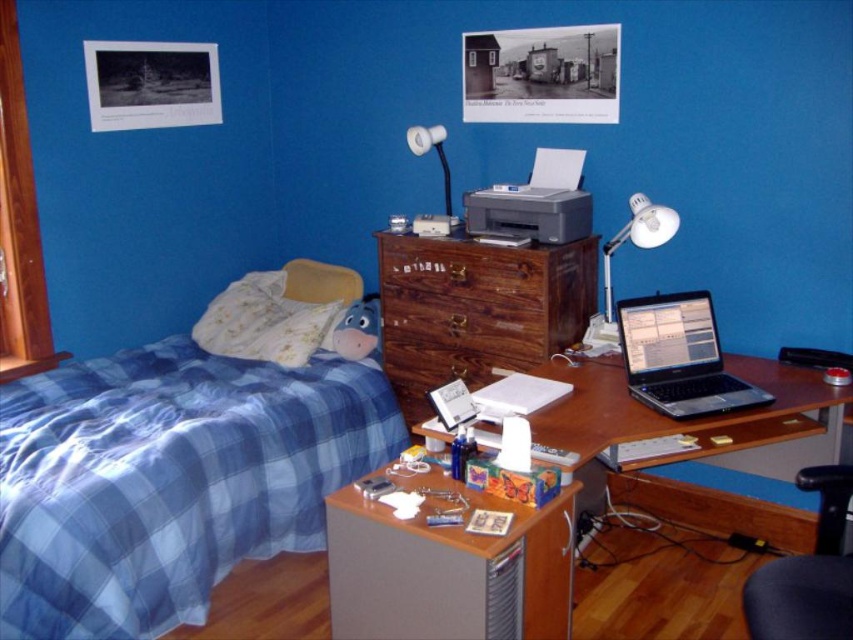
Consider the image. You are standing in the middle of the bedroom and want to place a new lamp on the wooden chest of drawers at center. Which direction should you move to reach it?

Since the wooden chest of drawers at center is located at point coordinates of [476,308], you are already standing in the middle of the bedroom, so you don not need to move any direction to reach it. You can place the new lamp directly on the wooden chest of drawers at center.

You are organizing your bedroom and need to move a 40 cm wide box from the wooden chest of drawers at center to the white plastic desk lamp at upper right. Can the box fit through the space between them without bending?

The wooden chest of drawers at center is 41.00 centimeters from the white plastic desk lamp at upper right, so the 40 cm wide box can fit through the space between them without bending.

You are organizing your bedroom and need to place a new bookshelf. The bookshelf is taller than the wooden chest of drawers at center. Will the bookshelf also be taller than the silver metallic printer at center?

The wooden chest of drawers at center is larger in size than the silver metallic printer at center. Since the bookshelf is taller than the wooden chest of drawers at center, it will also be taller than the silver metallic printer at center.